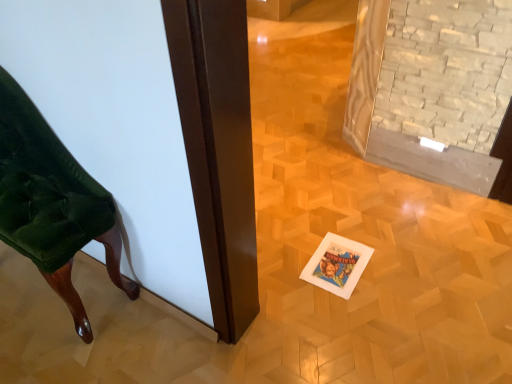
This screenshot has width=512, height=384. In order to click on free point to the right of white paper postcard at center in this screenshot , I will do `click(389, 264)`.